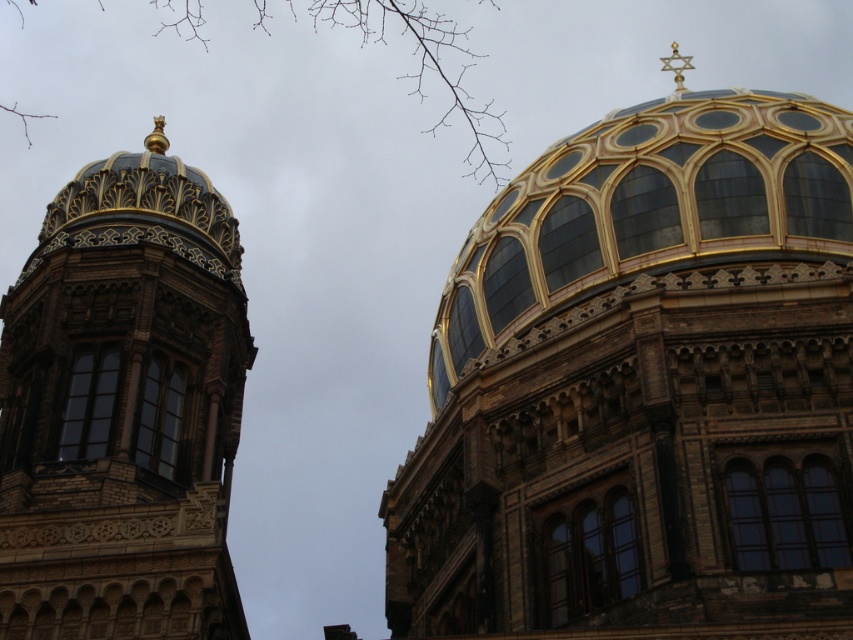
Question: Does golden glass dome at upper right appear under gold mosaic dome at upper left?

Choices:
 (A) no
 (B) yes

Answer: (A)

Question: Which of the following is the closest to the observer?

Choices:
 (A) (753, 356)
 (B) (42, 563)

Answer: (B)

Question: Can you confirm if golden glass dome at upper right is thinner than gold mosaic dome at upper left?

Choices:
 (A) no
 (B) yes

Answer: (A)

Question: Where is golden glass dome at upper right located in relation to gold mosaic dome at upper left in the image?

Choices:
 (A) left
 (B) right

Answer: (B)